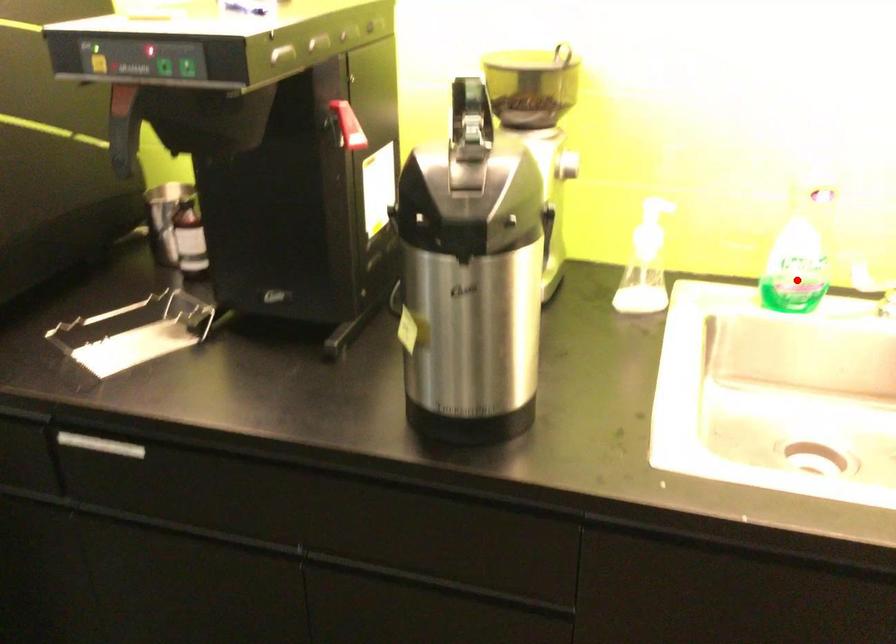
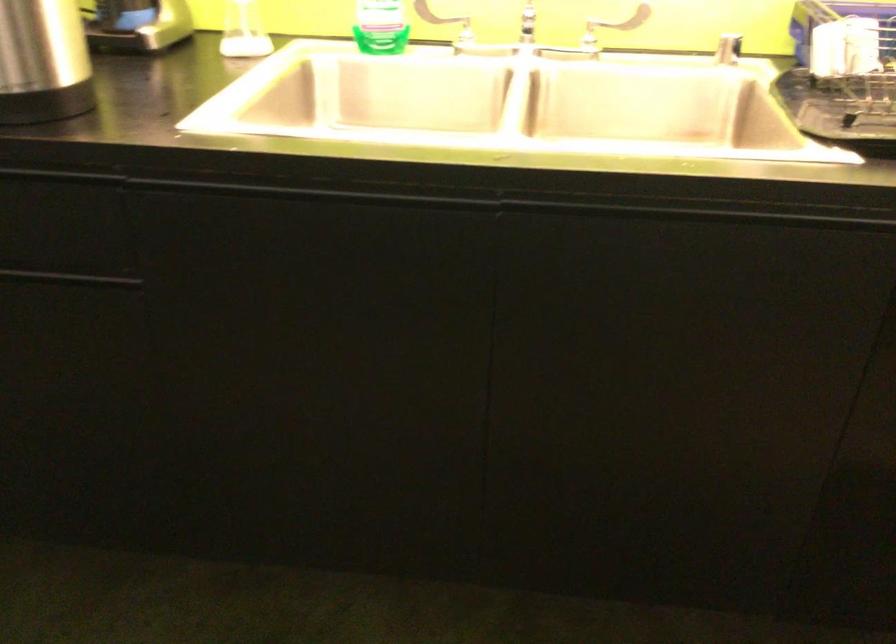
In the second image, find the point that corresponds to the highlighted location in the first image.

(381, 26)